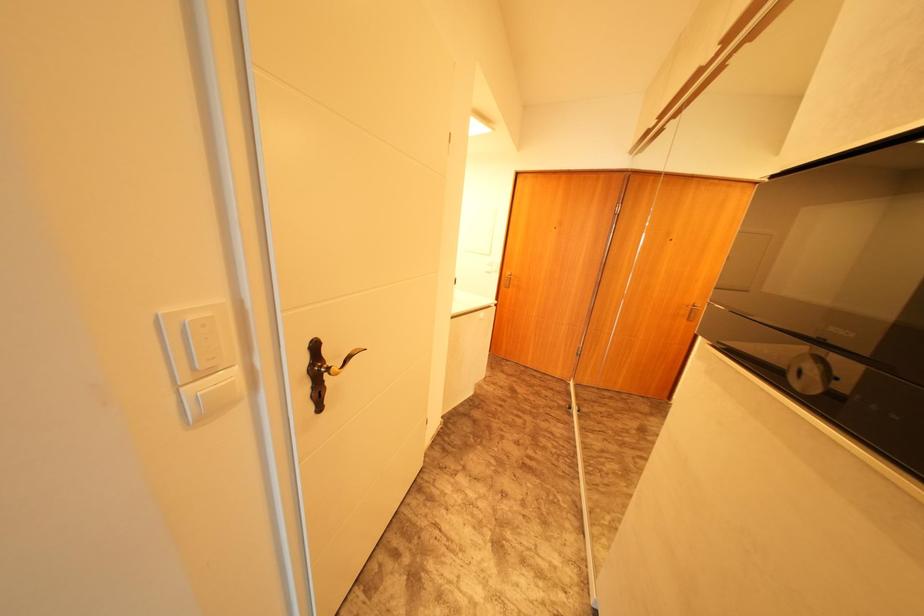
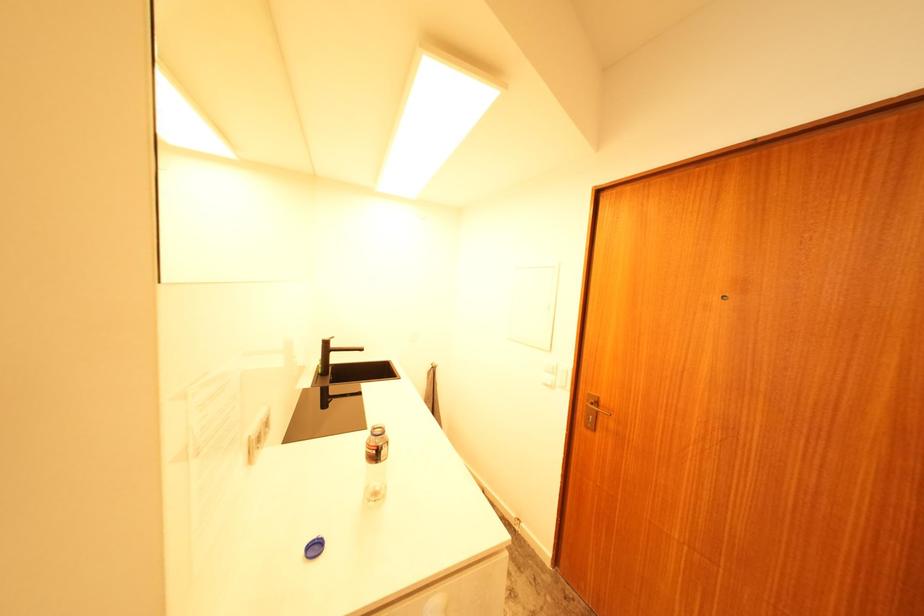
Question: Which direction would the cameraman need to move to produce the second image? Reply with the corresponding letter.

Choices:
 (A) Left
 (B) Right
 (C) Forward
 (D) Backward

Answer: (C)